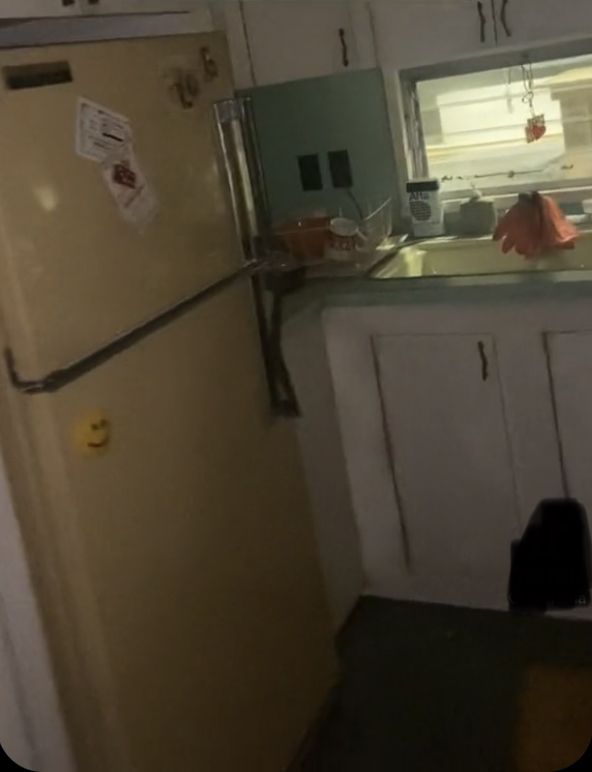
Locate an element on the screen. Image resolution: width=592 pixels, height=772 pixels. freezer is located at coordinates (50, 356).